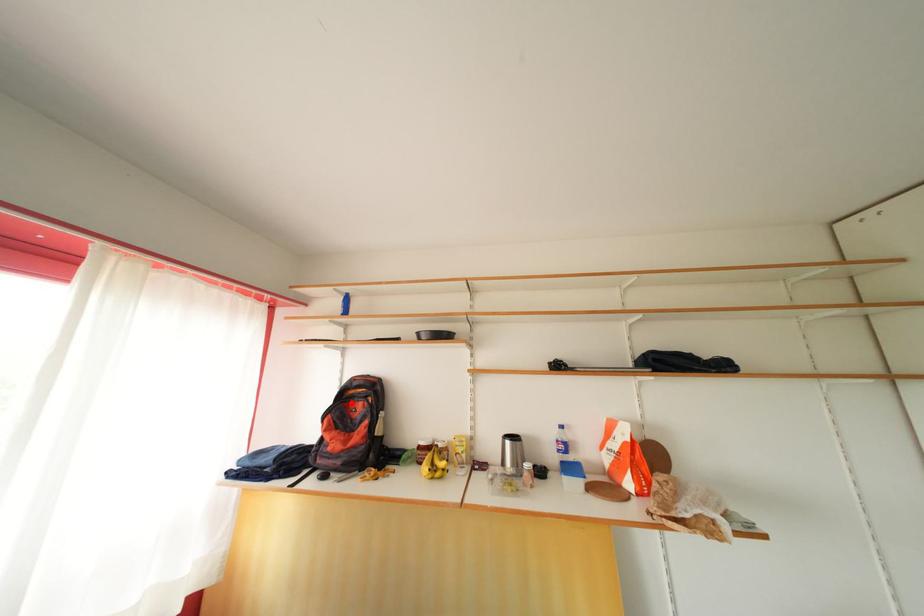
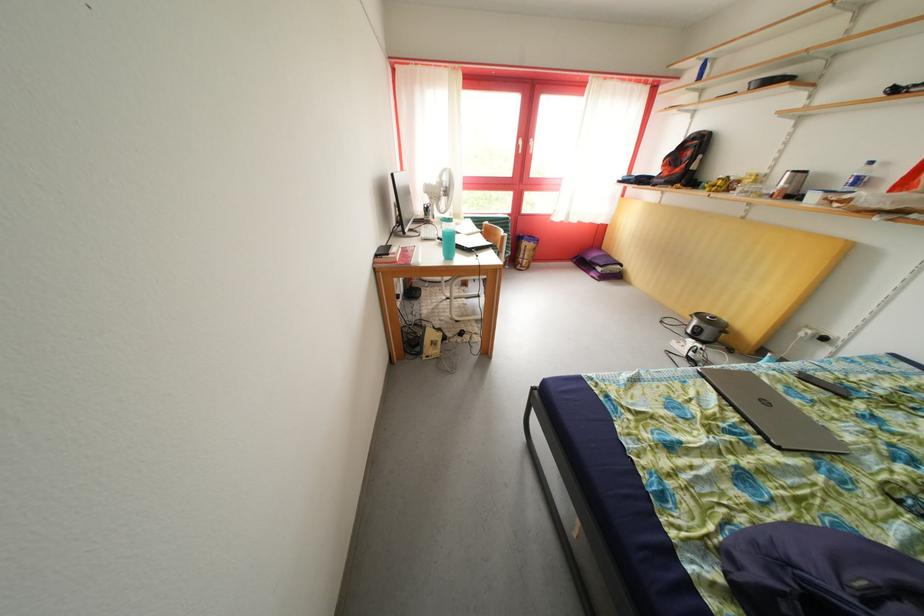
Question: A red point is marked in image1. In image2, is the corresponding 3D point closer to the camera or farther? Reply with the corresponding letter.

Choices:
 (A) The corresponding 3D point is closer.
 (B) The corresponding 3D point is farther.

Answer: (A)